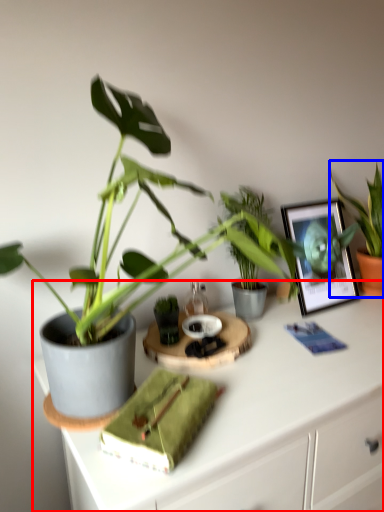
Question: Which point is further to the camera, desk (highlighted by a red box) or houseplant (highlighted by a blue box)?

Choices:
 (A) desk
 (B) houseplant

Answer: (B)